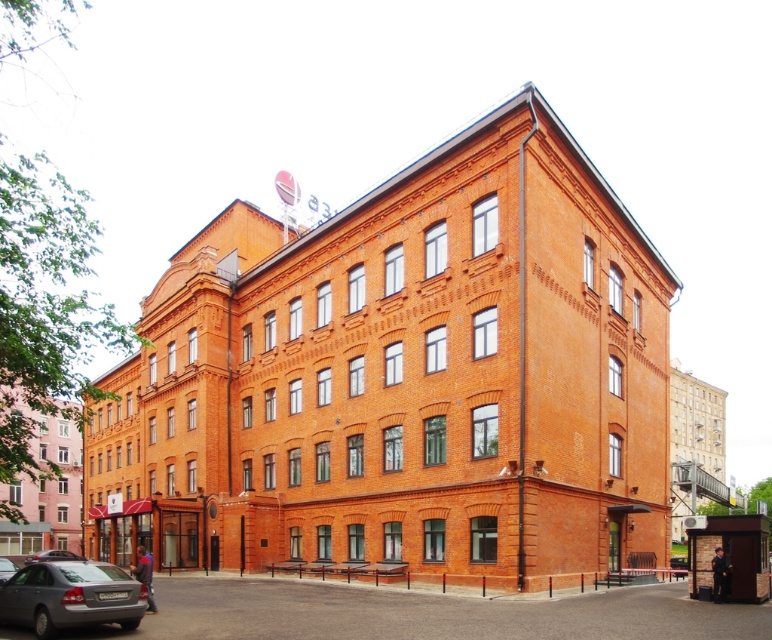
You are a delivery person trying to park your van in the parking lot near the large brick building. You notice there are two cars already parked at the lower left corner. Which car, the silver metallic car at lower left or the matte black car at lower left, would allow you to park closer to the entrance of the building?

The silver metallic car at lower left has a smaller size compared to the matte black car at lower left, so parking next to it would provide more space and allow you to park closer to the entrance of the building.

You are a delivery driver who needs to park your truck, which is 2.5 meters wide, in the parking lot near the large brick building. There are two vehicles present in the parking area. The silver metallic car at lower left and the metallic gray sedan at lower left. Can you determine if there is enough space between these two vehicles to park your truck?

The silver metallic car at lower left might be wider than metallic gray sedan at lower left. If the silver metallic car at lower left is indeed wider, the space between them may not be sufficient for the truck. However, if it is narrower, there might be enough space. Without exact measurements, it is uncertain if the truck can fit between them.

You are standing in front of the building and want to determine which of the two points, point (78, 556) or point (2, 576), is closer to you. Based on the building structure, which point is nearer?

Point (78, 556) is closer to you because it is further to the viewer than point (2, 576).